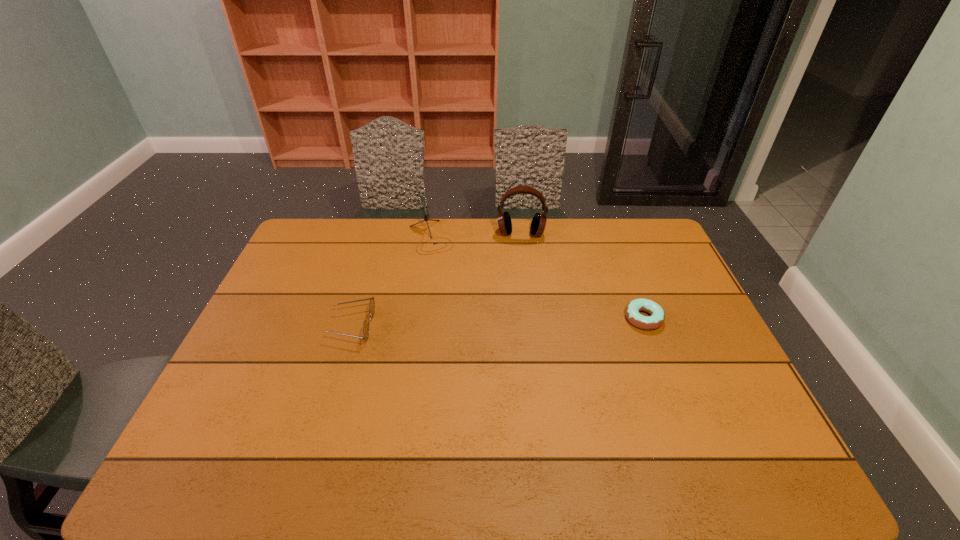
This screenshot has width=960, height=540. I want to click on object that is at the right edge, so click(657, 317).

The image size is (960, 540). I want to click on free space at the far edge, so click(492, 221).

Find the location of `vacant region at the near edge`. vacant region at the near edge is located at coordinates (662, 403).

This screenshot has width=960, height=540. I want to click on vacant space at the left edge, so pos(300,259).

Where is `vacant region at the right edge of the desktop`? Image resolution: width=960 pixels, height=540 pixels. vacant region at the right edge of the desktop is located at coordinates coord(724,372).

Where is `free space at the near left corner of the desktop`? This screenshot has width=960, height=540. free space at the near left corner of the desktop is located at coordinates (258, 420).

Locate an element on the screen. This screenshot has width=960, height=540. free space between the rightmost object and the tallest object is located at coordinates (582, 276).

Locate an element on the screen. The height and width of the screenshot is (540, 960). vacant region between the leftmost object and the shortest object is located at coordinates (498, 322).

Where is `free point between the spectacles and the microphone`? This screenshot has height=540, width=960. free point between the spectacles and the microphone is located at coordinates (392, 281).

This screenshot has width=960, height=540. I want to click on vacant point located between the third tallest object and the tallest object, so click(x=437, y=280).